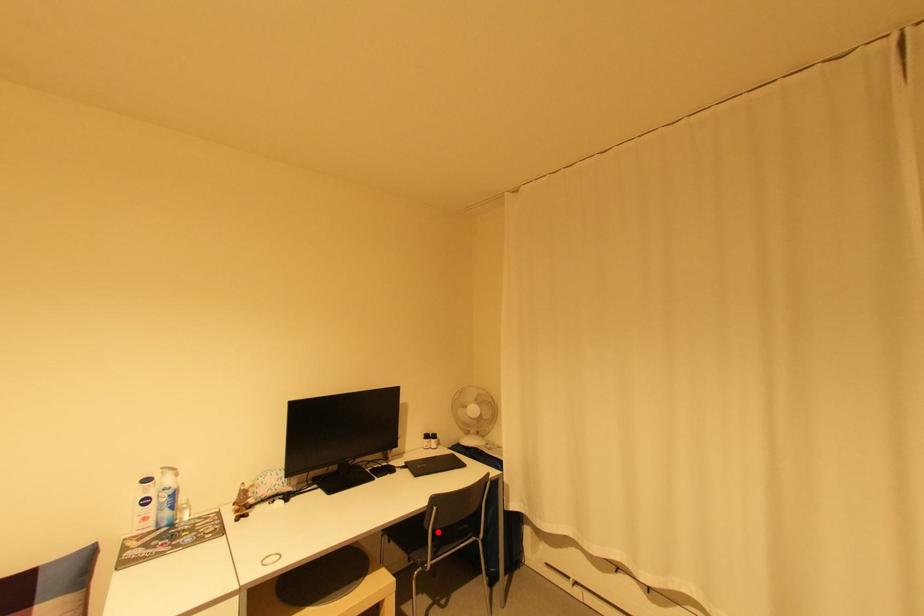
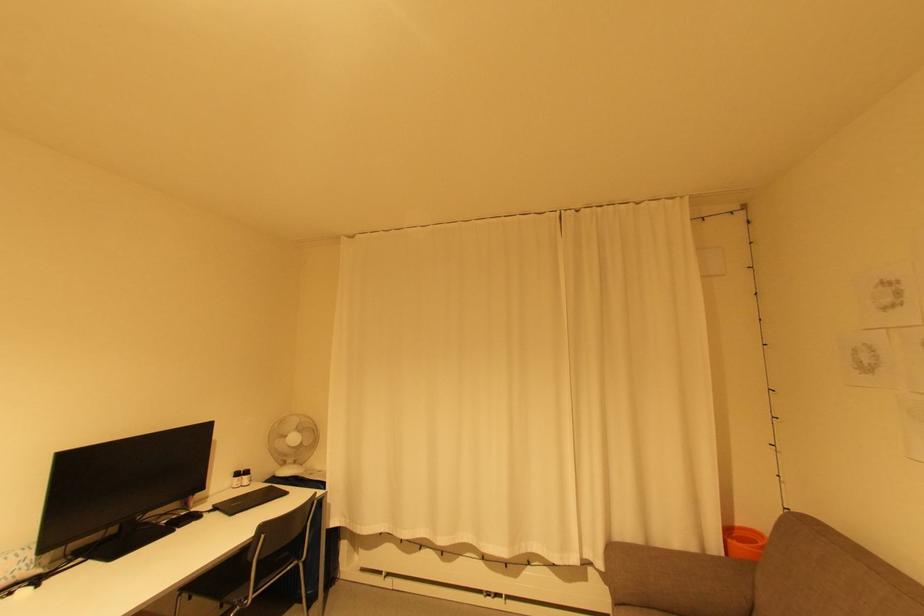
Question: I am providing you with two images of the same scene from different viewpoints. Given a red point in image1, look at the same physical point in image2. Is it:

Choices:
 (A) Closer to the viewpoint
 (B) Farther from the viewpoint

Answer: (A)